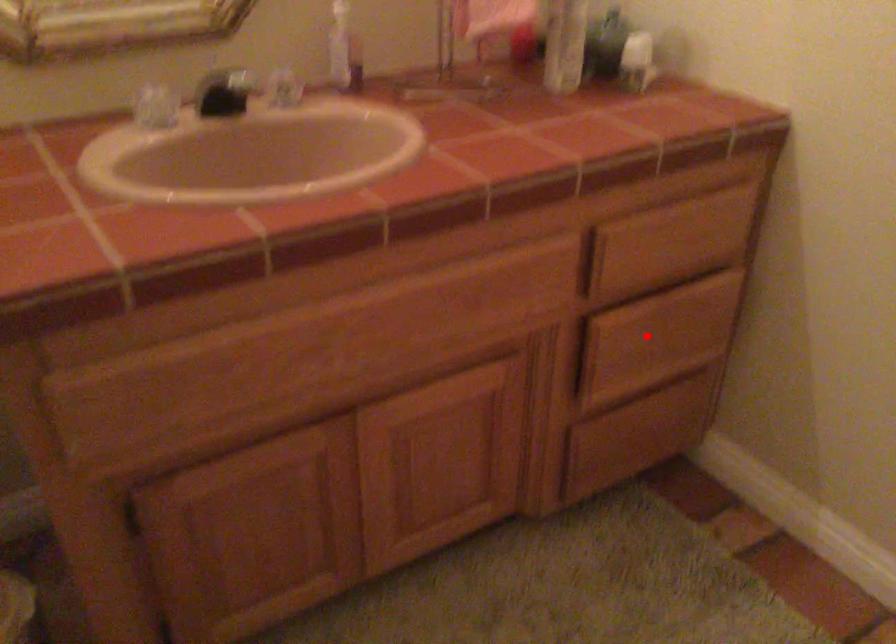
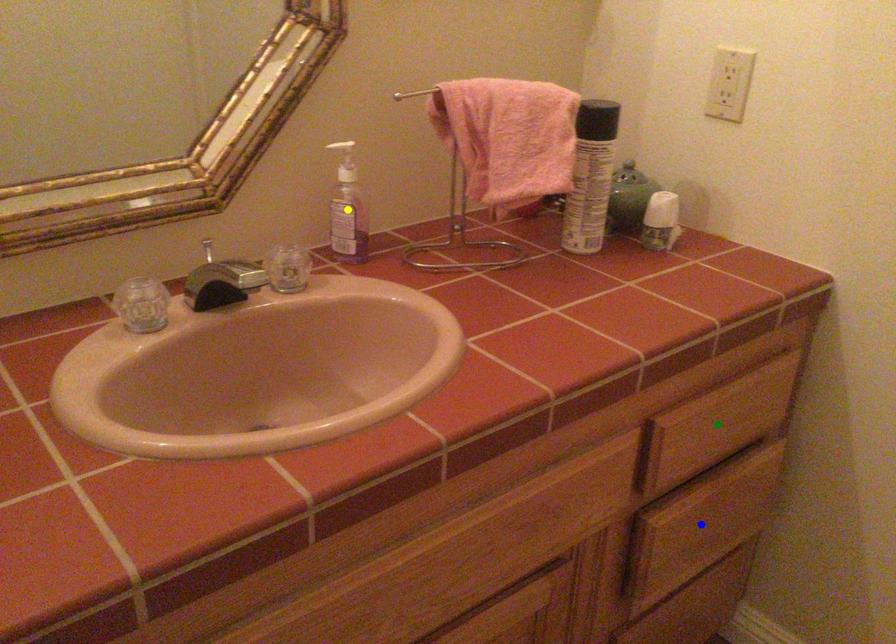
Question: I am providing you with two images of the same scene from different viewpoints. A red point is marked on the first image. You are given multiple points on the second image. Which point in image 2 represents the same 3d spot as the red point in image 1?

Choices:
 (A) yellow point
 (B) blue point
 (C) green point

Answer: (B)